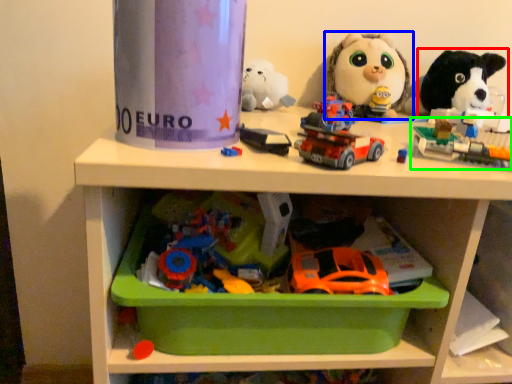
Question: Which object is positioned closest to toy (highlighted by a red box)? Select from toy (highlighted by a blue box) and toy (highlighted by a green box).

Choices:
 (A) toy
 (B) toy

Answer: (A)